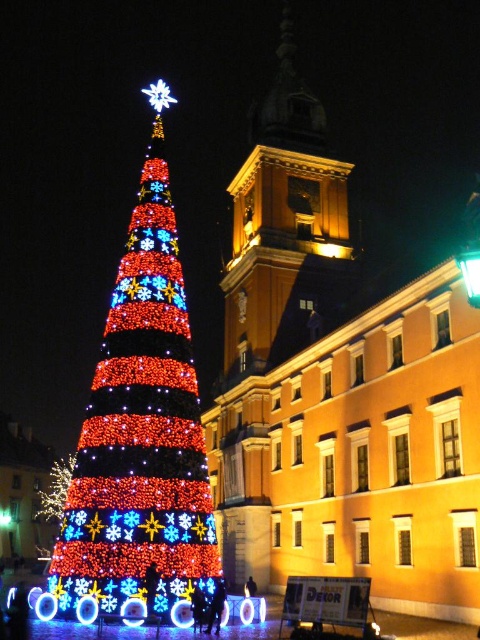
You are standing in front of the festive scene described. You want to take a photo of the golden stone bell tower at upper center. Considering your camera has a maximum focus range of 60 meters, will you be able to capture a clear image of it?

The golden stone bell tower at upper center is 66.45 meters away from the viewer. Since your camera can only focus up to 60 meters, it will not be able to capture a clear image of the golden stone bell tower at upper center.

You are standing in front of the festive scene with the Christmas tree and the historic building. There are two points marked in the image. Which point, point (112, 413) or point (249, 326), is closer to you?

Point (112, 413) is closer to the viewer than point (249, 326).